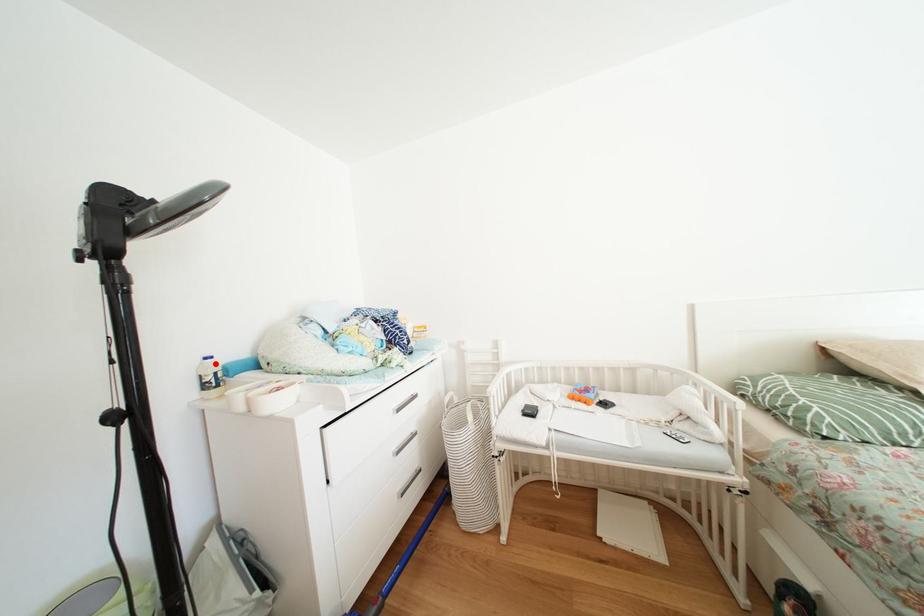
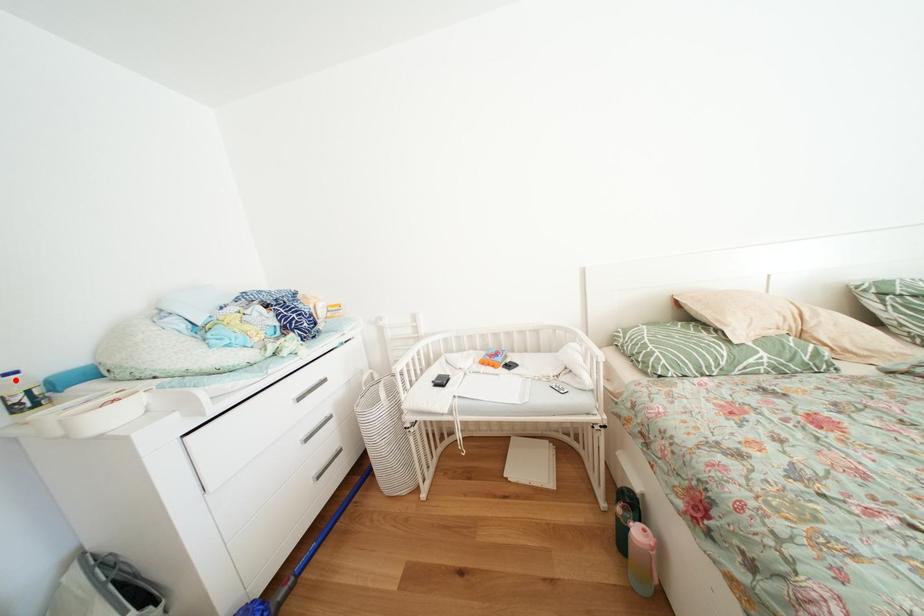
I am providing you with two images of the same scene from different viewpoints. A red point is marked on the first image and another point is marked on the second image. Is the marked point in image1 the same physical position as the marked point in image2?

Yes